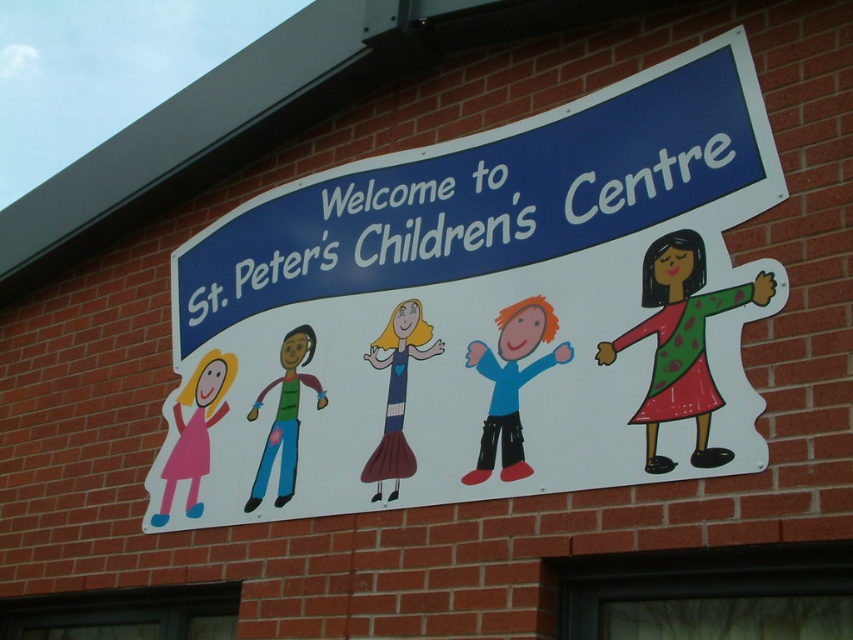
Question: Which of the following is the farthest from the observer?

Choices:
 (A) (537, 332)
 (B) (378, 472)
 (C) (675, 301)
 (D) (556, 134)

Answer: (D)

Question: Is white paper sign at center thinner than matte blue dress at center?

Choices:
 (A) yes
 (B) no

Answer: (B)

Question: Is green dotted dress at center closer to camera compared to matte blue shirt at center?

Choices:
 (A) yes
 (B) no

Answer: (A)

Question: Can you confirm if green dotted dress at center is positioned above matte blue dress at center?

Choices:
 (A) yes
 (B) no

Answer: (A)

Question: Among these objects, which one is nearest to the camera?

Choices:
 (A) white paper sign at center
 (B) matte blue shirt at center
 (C) matte blue dress at center

Answer: (A)

Question: Considering the real-world distances, which object is farthest from the matte pink dress at left?

Choices:
 (A) white paper sign at center
 (B) matte blue shirt at center
 (C) green dotted dress at center

Answer: (C)